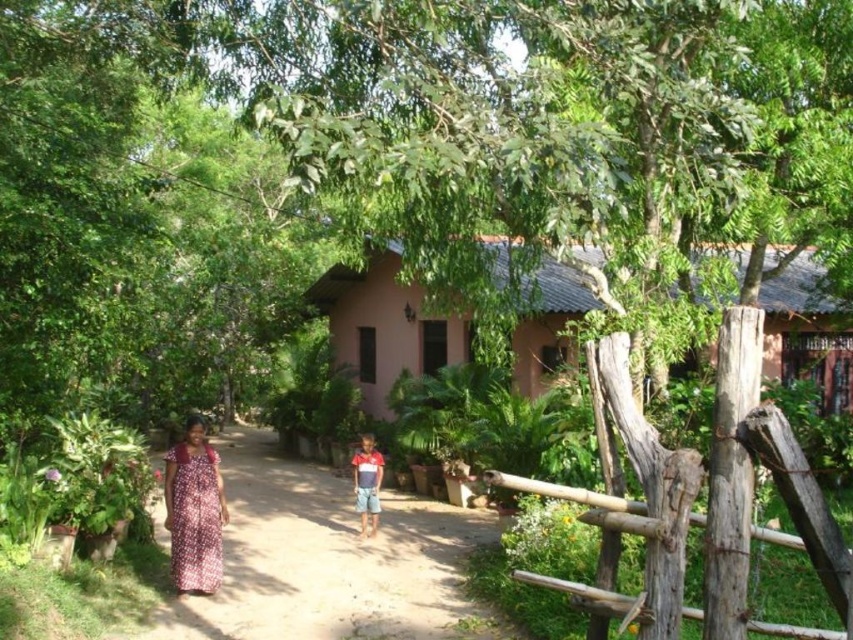
You are a photographer trying to capture the two people walking along the dirt path. Since you want to ensure both the printed cotton dress at lower left and the red striped shirt at center are clearly visible in the photo, which person should you focus on first to ensure proper focus?

The printed cotton dress at lower left is larger in size than the red striped shirt at center, so you should focus on the printed cotton dress at lower left first to ensure proper focus.